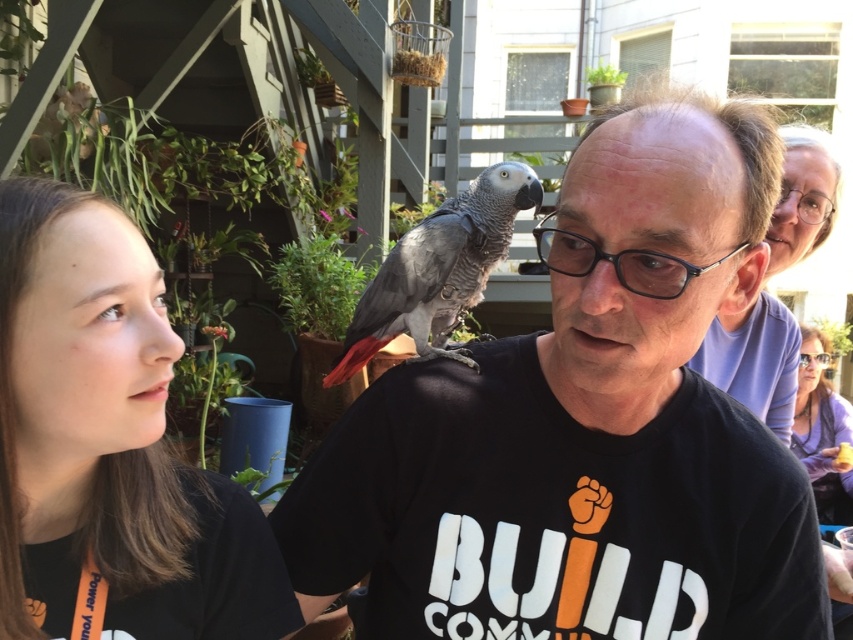
Is gray matte parrot at center above matte purple shirt at upper right?

Actually, gray matte parrot at center is below matte purple shirt at upper right.

Does gray matte parrot at center appear under matte purple shirt at upper right?

Correct, gray matte parrot at center is located below matte purple shirt at upper right.

Locate an element on the screen. The width and height of the screenshot is (853, 640). gray matte parrot at center is located at coordinates (438, 268).

Measure the distance between matte purple shirt at upper right and camera.

matte purple shirt at upper right is 4.79 feet from camera.

Find the location of a particular element. matte purple shirt at upper right is located at coordinates (755, 360).

Who is higher up, matte gray parrot at center or black plastic glasses at center?

black plastic glasses at center

You are a GUI agent. You are given a task and a screenshot of the screen. Output one action in this format:
    pyautogui.click(x=<x>, y=<y>)
    Task: Click on the matte gray parrot at center
    The width and height of the screenshot is (853, 640).
    Given the screenshot: What is the action you would take?
    pyautogui.click(x=584, y=428)